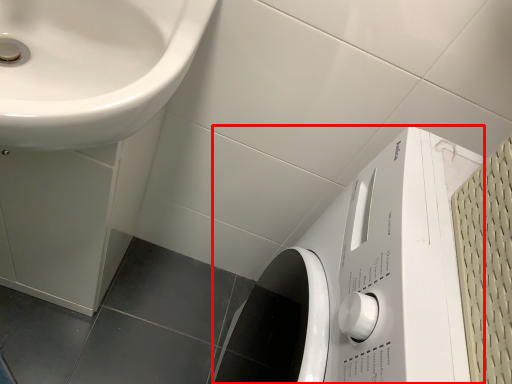
Question: Considering the relative positions of washing machine (annotated by the red box) and sink in the image provided, where is washing machine (annotated by the red box) located with respect to the staircase?

Choices:
 (A) left
 (B) right

Answer: (B)